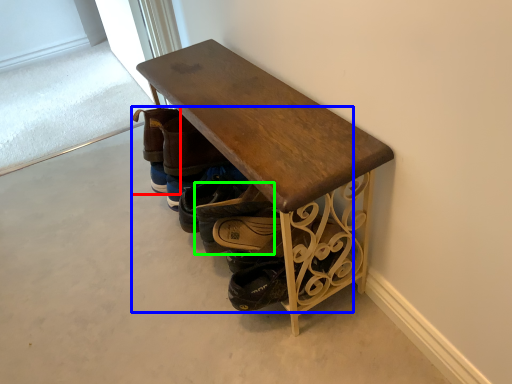
Question: Based on their relative distances, which object is farther from footwear (highlighted by a red box)? Choose from footwear (highlighted by a blue box) and footwear (highlighted by a green box).

Choices:
 (A) footwear
 (B) footwear

Answer: (B)